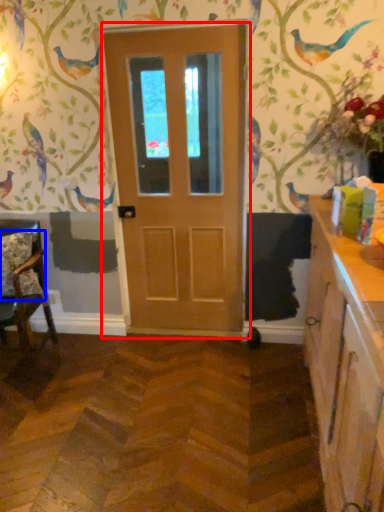
Question: Which of the following is the closest to the observer, door (highlighted by a red box) or pillow (highlighted by a blue box)?

Choices:
 (A) door
 (B) pillow

Answer: (A)